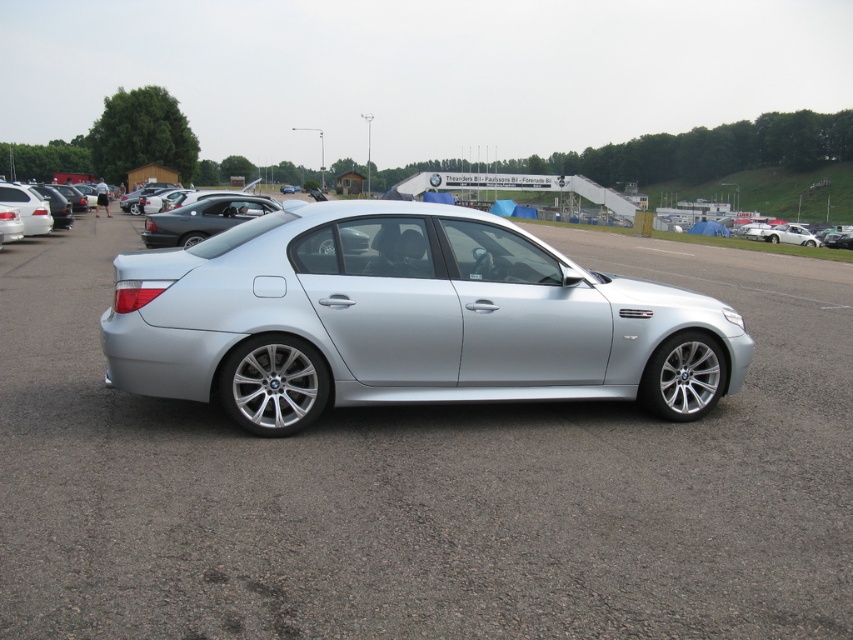
You are standing in front of the silver BMW sedan in the parking lot. There are two points marked on the car, one at coordinates point [287,625] and another at point [33,196]. Which of these two points do you think is closer to your current position?

Point [287,625] is closer to the viewer than point [33,196], so the point at coordinates point [287,625] is closer to your current position.

Looking at this image, you are standing in the parking lot and want to take a photo of the silver BMW sedan. You notice two points marked on the car, one at point (131, 307) and another at point (27, 193). Which point will appear larger in your photo?

Point (131, 307) will appear larger in the photo because it is closer to the camera than point (27, 193).

You are a parking attendant trying to direct a driver to their car. You see the satin silver car at center and the silver metallic sedan at left. Which car is positioned lower in the image?

The satin silver car at center is located below the silver metallic sedan at left, so it is positioned lower in the image.